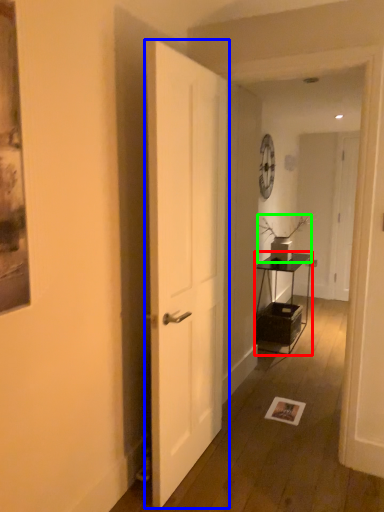
Question: Considering the real-world distances, which object is closest to table (highlighted by a red box)? door (highlighted by a blue box) or houseplant (highlighted by a green box).

Choices:
 (A) door
 (B) houseplant

Answer: (B)